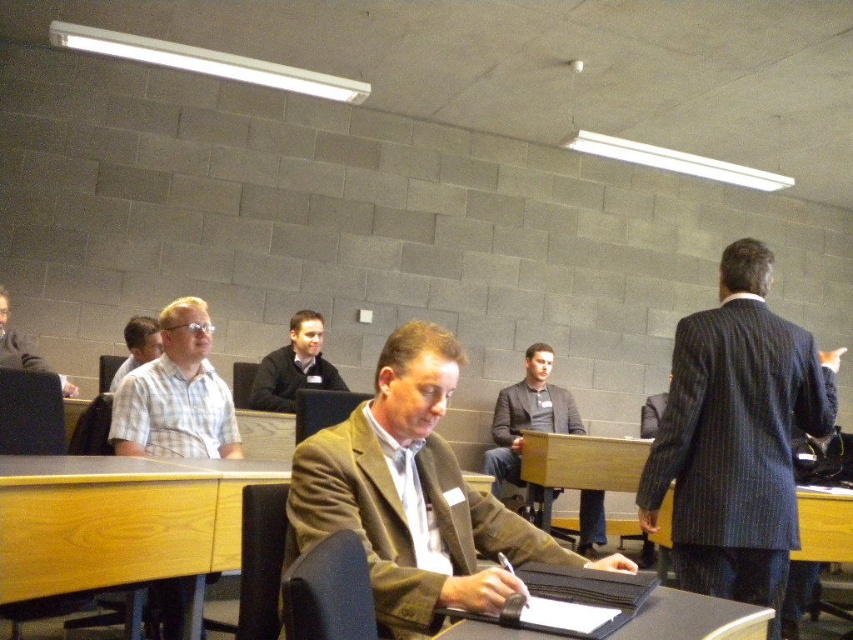
Question: Is wooden desk at center below smooth black table at center?

Choices:
 (A) no
 (B) yes

Answer: (B)

Question: Does wooden at center have a greater width compared to light blue shirt at center?

Choices:
 (A) no
 (B) yes

Answer: (B)

Question: Among these objects, which one is farthest from the camera?

Choices:
 (A) wooden desk at center
 (B) dark gray suit at center

Answer: (B)

Question: Which object is the farthest from the light blue shirt at center?

Choices:
 (A) white checkered shirt at left
 (B) dark gray sweater at center
 (C) brown woolen suit at center

Answer: (C)

Question: Is dark gray sweater at center closer to the viewer compared to light brown wood chair at left?

Choices:
 (A) no
 (B) yes

Answer: (A)

Question: Which point is farther to the camera?

Choices:
 (A) light brown wood chair at left
 (B) dark gray sweater at center

Answer: (B)